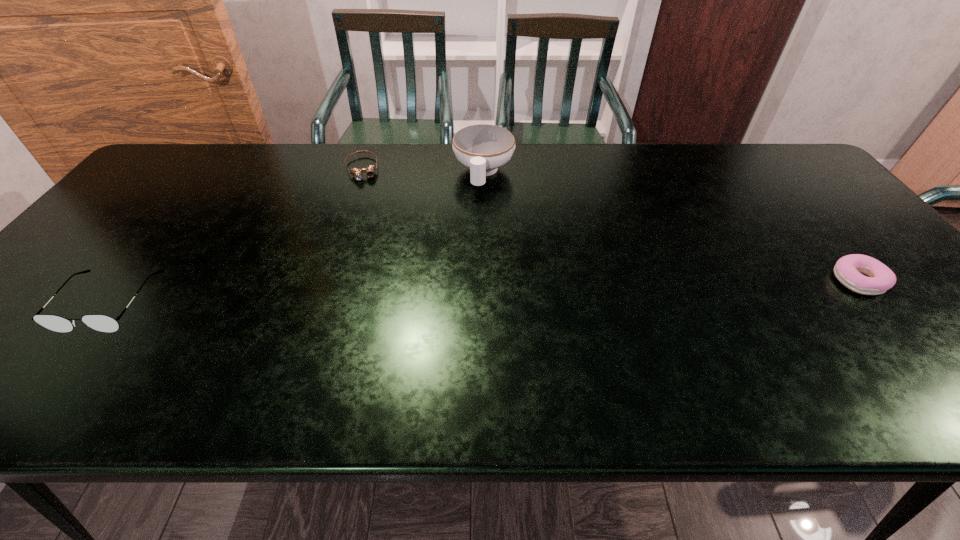
Image resolution: width=960 pixels, height=540 pixels. I want to click on vacant space on the desktop that is between the leftmost object and the pastry and is positioned on the side with the handle of the tallest object, so click(x=453, y=292).

Identify the location of free spot on the desktop that is between the leftmost object and the rightmost object and is positioned on the front lenses and sides of the shortest object. This screenshot has height=540, width=960. (393, 294).